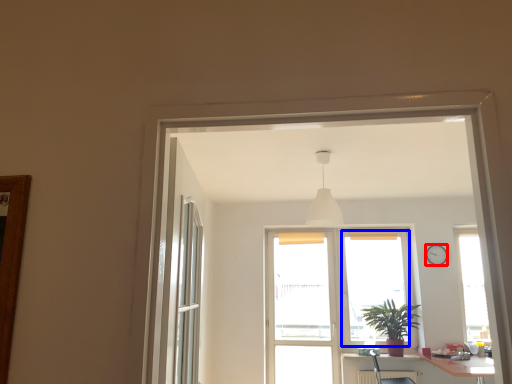
Question: Which object is closer to the camera taking this photo, clock (highlighted by a red box) or window screen (highlighted by a blue box)?

Choices:
 (A) clock
 (B) window screen

Answer: (A)